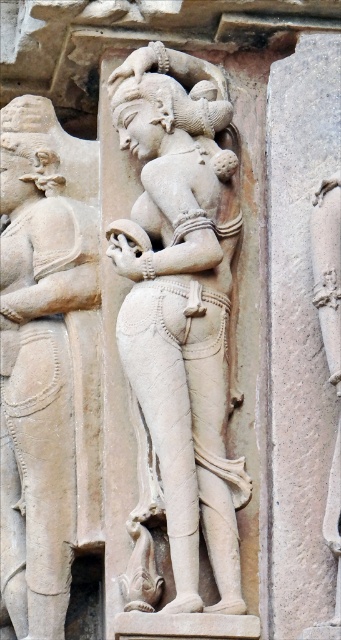
Can you confirm if stone statue at center is positioned above smooth stone pillar at center?

Actually, stone statue at center is below smooth stone pillar at center.

What do you see at coordinates (179, 323) in the screenshot? I see `stone statue at center` at bounding box center [179, 323].

Identify the location of stone statue at center. This screenshot has width=341, height=640. (179, 323).

Which is in front, point (155, 404) or point (54, 316)?

Point (155, 404)

Identify the location of stone statue at center. The image size is (341, 640). (179, 323).

The width and height of the screenshot is (341, 640). I want to click on stone statue at center, so click(x=179, y=323).

What do you see at coordinates (47, 364) in the screenshot?
I see `beige stone statue at left` at bounding box center [47, 364].

Can you confirm if beige stone statue at left is wider than smooth stone pillar at center?

Indeed, beige stone statue at left has a greater width compared to smooth stone pillar at center.

Where is `beige stone statue at left`? beige stone statue at left is located at coordinates (47, 364).

Identify the location of beige stone statue at left. (47, 364).